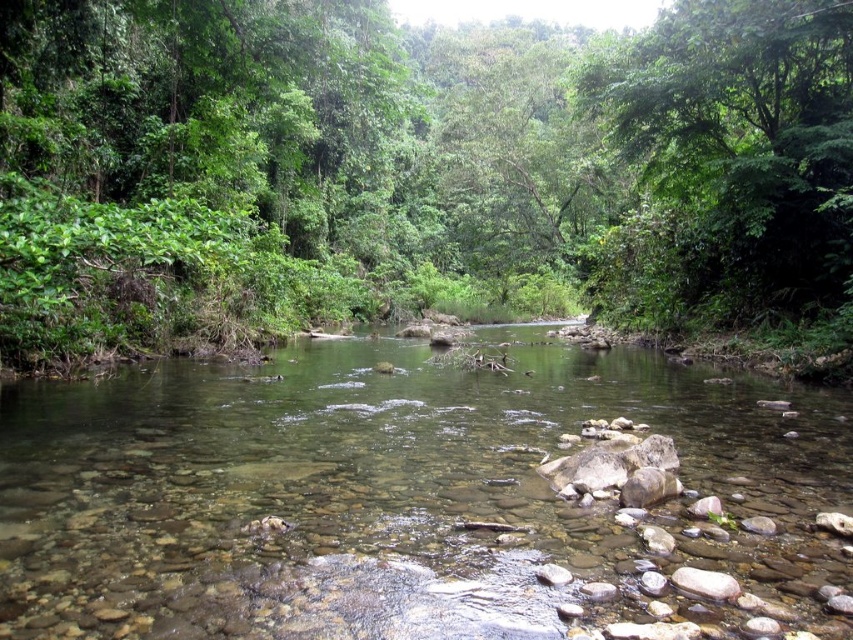
How much distance is there between green leafy tree at center and green leafy tree at upper center?

green leafy tree at center is 27.02 feet away from green leafy tree at upper center.

Does point (196, 24) lie behind point (666, 240)?

No, (196, 24) is closer to viewer.

What are the coordinates of `green leafy tree at center` in the screenshot? It's located at (421, 170).

Is green leafy tree at center wider than clear stone stream at center?

Indeed, green leafy tree at center has a greater width compared to clear stone stream at center.

Between green leafy tree at center and clear stone stream at center, which one is positioned higher?

green leafy tree at center is higher up.

Describe the element at coordinates (421, 170) in the screenshot. This screenshot has width=853, height=640. I see `green leafy tree at center` at that location.

What are the coordinates of `green leafy tree at center` in the screenshot? It's located at (421, 170).

Does point (448, 499) come behind point (833, 104)?

No, (448, 499) is closer to viewer.

Can you confirm if clear stone stream at center is shorter than green leafy tree at upper center?

Indeed, clear stone stream at center has a lesser height compared to green leafy tree at upper center.

The image size is (853, 640). What are the coordinates of `clear stone stream at center` in the screenshot? It's located at (412, 497).